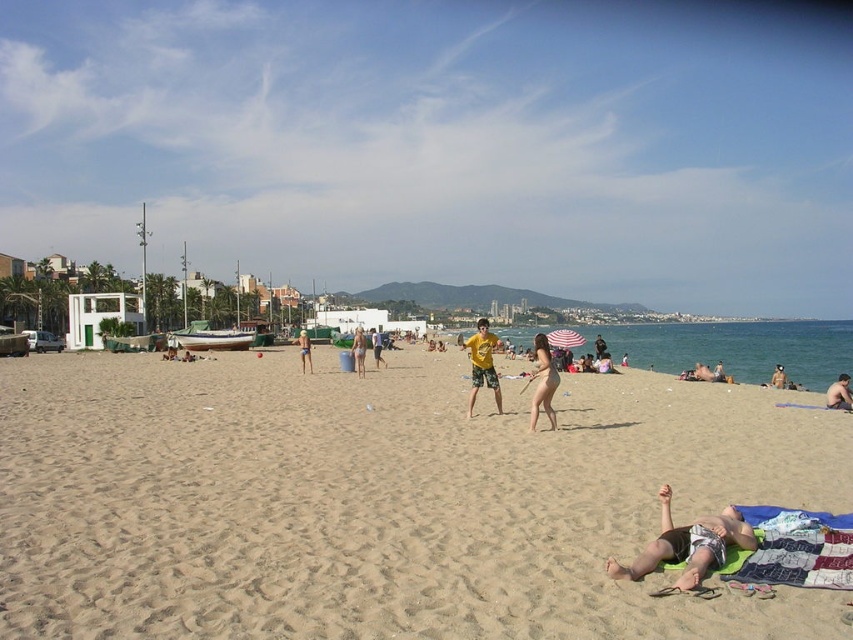
Between transparent blue sky at upper center and nude skin at center, which one appears on the right side from the viewer's perspective?

From the viewer's perspective, nude skin at center appears more on the right side.

Measure the distance between point (135, 93) and camera.

Point (135, 93) and camera are 272.76 meters apart from each other.

What do you see at coordinates (444, 144) in the screenshot?
I see `transparent blue sky at upper center` at bounding box center [444, 144].

At what (x,y) coordinates should I click in order to perform the action: click on transparent blue sky at upper center. Please return your answer as a coordinate pair (x, y). The width and height of the screenshot is (853, 640). Looking at the image, I should click on (444, 144).

Can you confirm if nude skin at center is bigger than tan skin person at center?

Incorrect, nude skin at center is not larger than tan skin person at center.

Who is shorter, nude skin at center or tan skin person at center?

Standing shorter between the two is nude skin at center.

Describe the element at coordinates (543, 381) in the screenshot. I see `nude skin at center` at that location.

Find the location of a particular element. The height and width of the screenshot is (640, 853). nude skin at center is located at coordinates (543, 381).

Can you confirm if tan skin person at center is wider than matte yellow t-shirt at center?

Yes, tan skin person at center is wider than matte yellow t-shirt at center.

Is tan skin person at center behind matte yellow t-shirt at center?

No, it is not.

The height and width of the screenshot is (640, 853). I want to click on tan skin person at center, so click(x=305, y=349).